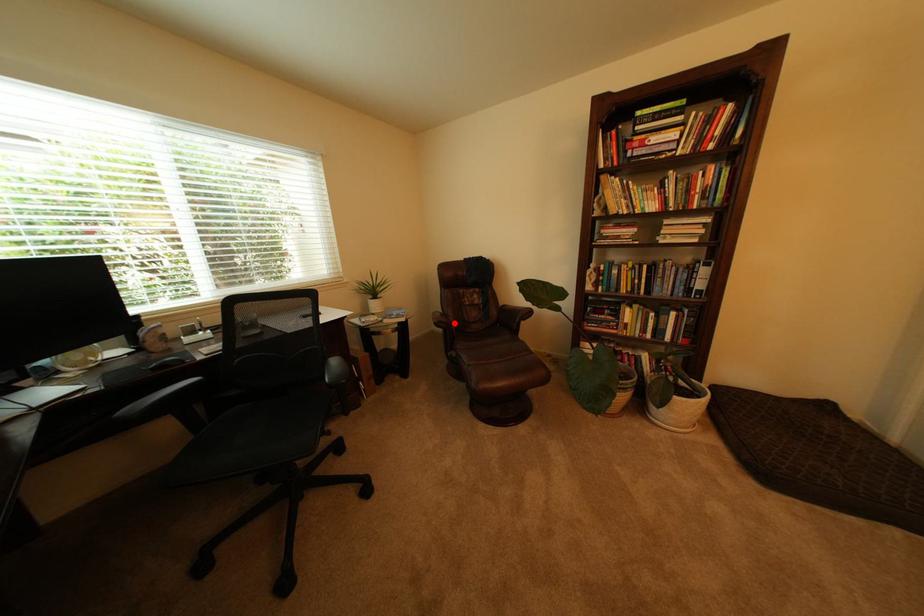
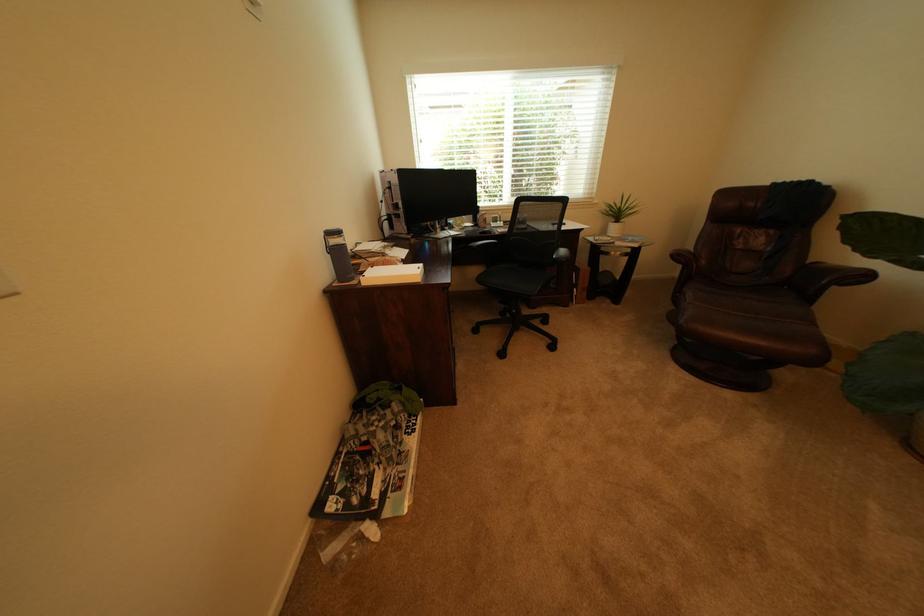
Question: I am providing you with two images of the same scene from different viewpoints. Given a red point in image1, look at the same physical point in image2. Is it:

Choices:
 (A) Closer to the viewpoint
 (B) Farther from the viewpoint

Answer: (B)